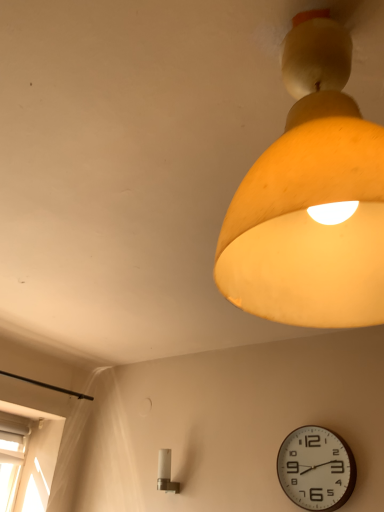
Locate an element on the screen. matte yellow lampshade at upper right, positioned as the second lamp in back-to-front order is located at coordinates (311, 199).

What do you see at coordinates (311, 199) in the screenshot? The image size is (384, 512). I see `matte yellow lampshade at upper right, positioned as the second lamp in back-to-front order` at bounding box center [311, 199].

Identify the location of white plastic clock at lower right. (316, 468).

Is white plastic clock at lower right located within matte yellow lampshade at upper right, the first lamp from the top?

No, matte yellow lampshade at upper right, the first lamp from the top, does not contain white plastic clock at lower right.

You are a GUI agent. You are given a task and a screenshot of the screen. Output one action in this format:
    pyautogui.click(x=<x>, y=<y>)
    Task: Click on the lamp above the white plastic clock at lower right (from a real-world perspective)
    This screenshot has width=384, height=512.
    Given the screenshot: What is the action you would take?
    pyautogui.click(x=311, y=199)

In the image, is matte yellow lampshade at upper right, positioned as the second lamp in back-to-front order, positioned in front of or behind white plastic clock at lower right?

matte yellow lampshade at upper right, positioned as the second lamp in back-to-front order, is positioned closer to the viewer than white plastic clock at lower right.

Is point (350, 161) closer to camera compared to point (345, 451)?

Yes, point (350, 161) is closer to viewer.

Which is nearer, (253, 170) or (177, 485)?

Point (253, 170) is positioned closer to the camera compared to point (177, 485).

At what (x,y) coordinates should I click in order to perform the action: click on lamp behind the matte yellow lampshade at upper right, which is the second lamp in left-to-right order. Please return your answer as a coordinate pair (x, y). This screenshot has width=384, height=512. Looking at the image, I should click on (166, 473).

Does matte yellow lampshade at upper right, the first lamp from the top, contain white glossy light fixture at lower center, which appears as the 1th lamp when ordered from the bottom?

No, white glossy light fixture at lower center, which appears as the 1th lamp when ordered from the bottom, is not a part of matte yellow lampshade at upper right, the first lamp from the top.

Is white plastic clock at lower right bigger or smaller than matte yellow lampshade at upper right, positioned as the second lamp in back-to-front order?

white plastic clock at lower right is smaller than matte yellow lampshade at upper right, positioned as the second lamp in back-to-front order.

Can you confirm if white plastic clock at lower right is taller than matte yellow lampshade at upper right, the 1th lamp in the right-to-left sequence?

No.

Could matte yellow lampshade at upper right, the 1th lamp positioned from the front, be considered to be inside white plastic clock at lower right?

No, matte yellow lampshade at upper right, the 1th lamp positioned from the front, is not inside white plastic clock at lower right.

Where is `lamp that appears above the white plastic clock at lower right (from a real-world perspective)`? This screenshot has height=512, width=384. lamp that appears above the white plastic clock at lower right (from a real-world perspective) is located at coordinates (311, 199).

How much distance is there between white glossy light fixture at lower center, which appears as the 1th lamp when ordered from the bottom, and white plastic clock at lower right?

white glossy light fixture at lower center, which appears as the 1th lamp when ordered from the bottom, and white plastic clock at lower right are 25.63 inches apart.

Is point (162, 468) positioned in front of point (333, 466)?

No, (162, 468) is further to viewer.

Can white plastic clock at lower right be found inside white glossy light fixture at lower center, which is counted as the 1th lamp, starting from the left?

Definitely not — white plastic clock at lower right is not inside white glossy light fixture at lower center, which is counted as the 1th lamp, starting from the left.

The image size is (384, 512). In order to click on lamp behind the white plastic clock at lower right in this screenshot , I will do `click(166, 473)`.

From a real-world perspective, is white plastic clock at lower right below white glossy light fixture at lower center, which appears as the 1th lamp when ordered from the bottom?

No, from a real-world perspective, white plastic clock at lower right is not under white glossy light fixture at lower center, which appears as the 1th lamp when ordered from the bottom.

Locate an element on the screen. wall clock above the white glossy light fixture at lower center, which is counted as the 1th lamp, starting from the left (from a real-world perspective) is located at coordinates (316, 468).

Would you say white plastic clock at lower right is inside or outside white glossy light fixture at lower center, which appears as the 1th lamp when ordered from the bottom?

white plastic clock at lower right cannot be found inside white glossy light fixture at lower center, which appears as the 1th lamp when ordered from the bottom.

How different are the orientations of white plastic clock at lower right and white glossy light fixture at lower center, which is the 1th lamp in back-to-front order, in degrees?

0.000727 degrees.

Is white glossy light fixture at lower center, which appears as the 1th lamp when ordered from the bottom, far away from matte yellow lampshade at upper right, the first lamp from the top?

white glossy light fixture at lower center, which appears as the 1th lamp when ordered from the bottom, is positioned a significant distance from matte yellow lampshade at upper right, the first lamp from the top.

What's the angular difference between white glossy light fixture at lower center, placed as the second lamp when sorted from front to back, and matte yellow lampshade at upper right, the first lamp from the top,'s facing directions?

180 degrees separate the facing orientations of white glossy light fixture at lower center, placed as the second lamp when sorted from front to back, and matte yellow lampshade at upper right, the first lamp from the top.

From their relative heights in the image, would you say white glossy light fixture at lower center, which appears as the second lamp when viewed from the top, is taller or shorter than matte yellow lampshade at upper right, the first lamp from the top?

white glossy light fixture at lower center, which appears as the second lamp when viewed from the top, is shorter than matte yellow lampshade at upper right, the first lamp from the top.

Does white glossy light fixture at lower center, the second lamp in the right-to-left sequence, turn towards matte yellow lampshade at upper right, which is the second lamp in left-to-right order?

No, white glossy light fixture at lower center, the second lamp in the right-to-left sequence, does not turn towards matte yellow lampshade at upper right, which is the second lamp in left-to-right order.

You are a GUI agent. You are given a task and a screenshot of the screen. Output one action in this format:
    pyautogui.click(x=<x>, y=<y>)
    Task: Click on the 1st lamp counting from the left side of the white plastic clock at lower right
    This screenshot has width=384, height=512.
    Given the screenshot: What is the action you would take?
    pyautogui.click(x=311, y=199)

This screenshot has height=512, width=384. In order to click on lamp above the white glossy light fixture at lower center, which appears as the 1th lamp when ordered from the bottom (from a real-world perspective) in this screenshot , I will do `click(311, 199)`.

Considering their positions, is white plastic clock at lower right positioned closer to matte yellow lampshade at upper right, positioned as the second lamp in back-to-front order, than white glossy light fixture at lower center, which is the 1th lamp in back-to-front order?

Based on the image, white plastic clock at lower right appears to be nearer to matte yellow lampshade at upper right, positioned as the second lamp in back-to-front order.

When comparing their distances from white plastic clock at lower right, does white glossy light fixture at lower center, which appears as the second lamp when viewed from the top, or matte yellow lampshade at upper right, which is the second lamp in left-to-right order, seem further?

matte yellow lampshade at upper right, which is the second lamp in left-to-right order.

Based on their spatial positions, is matte yellow lampshade at upper right, which is the second lamp in left-to-right order, or white glossy light fixture at lower center, the second lamp in the right-to-left sequence, further from white plastic clock at lower right?

matte yellow lampshade at upper right, which is the second lamp in left-to-right order, is positioned further to the anchor white plastic clock at lower right.

Looking at this image, considering their positions, is white glossy light fixture at lower center, the second lamp in the right-to-left sequence, positioned closer to matte yellow lampshade at upper right, the 1th lamp positioned from the front, than white plastic clock at lower right?

white plastic clock at lower right is closer to matte yellow lampshade at upper right, the 1th lamp positioned from the front.

Which object lies nearer to the anchor point white glossy light fixture at lower center, placed as the second lamp when sorted from front to back, white plastic clock at lower right or matte yellow lampshade at upper right, the 1th lamp positioned from the front?

white plastic clock at lower right is closer to white glossy light fixture at lower center, placed as the second lamp when sorted from front to back.

Considering their positions, is matte yellow lampshade at upper right, the first lamp from the top, positioned closer to white glossy light fixture at lower center, the second lamp in the right-to-left sequence, than white plastic clock at lower right?

white plastic clock at lower right is positioned closer to the anchor white glossy light fixture at lower center, the second lamp in the right-to-left sequence.

Image resolution: width=384 pixels, height=512 pixels. I want to click on wall clock between matte yellow lampshade at upper right, positioned as the second lamp in back-to-front order, and white glossy light fixture at lower center, the second lamp in the right-to-left sequence, along the z-axis, so click(316, 468).